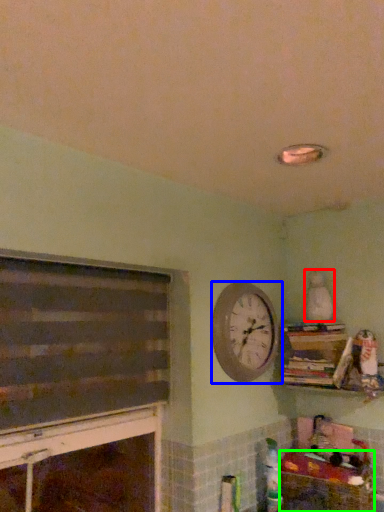
Question: Estimate the real-world distances between objects in this image. Which object is closer to toy (highlighted by a red box), wall clock (highlighted by a blue box) or crate (highlighted by a green box)?

Choices:
 (A) wall clock
 (B) crate

Answer: (A)